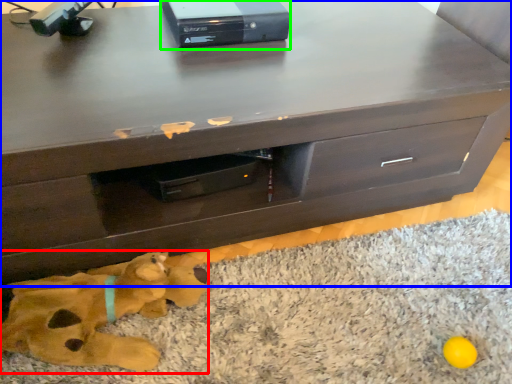
Question: Based on their relative distances, which object is nearer to animal (highlighted by a red box)? Choose from chest of drawers (highlighted by a blue box) and equipment (highlighted by a green box).

Choices:
 (A) chest of drawers
 (B) equipment

Answer: (A)